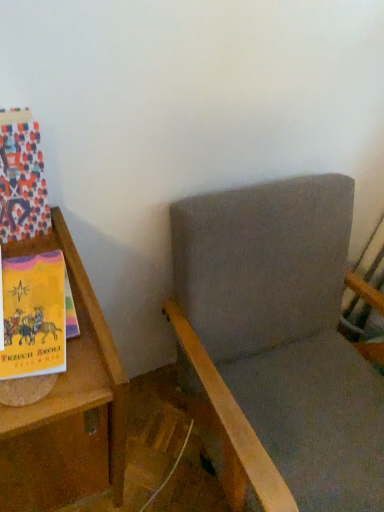
Question: Is wooden bookshelf at left at the left side of gray fabric rocking chair at center?

Choices:
 (A) yes
 (B) no

Answer: (A)

Question: Considering the relative sizes of wooden bookshelf at left and gray fabric rocking chair at center in the image provided, is wooden bookshelf at left shorter than gray fabric rocking chair at center?

Choices:
 (A) yes
 (B) no

Answer: (A)

Question: From the image's perspective, is wooden bookshelf at left on top of gray fabric rocking chair at center?

Choices:
 (A) yes
 (B) no

Answer: (B)

Question: Can you confirm if wooden bookshelf at left is thinner than gray fabric rocking chair at center?

Choices:
 (A) yes
 (B) no

Answer: (A)

Question: Does wooden bookshelf at left have a larger size compared to gray fabric rocking chair at center?

Choices:
 (A) no
 (B) yes

Answer: (A)

Question: Considering the positions of wooden bookshelf at left and multicolored paper at left in the image, is wooden bookshelf at left taller or shorter than multicolored paper at left?

Choices:
 (A) short
 (B) tall

Answer: (B)

Question: From a real-world perspective, is wooden bookshelf at left positioned above or below multicolored paper at left?

Choices:
 (A) below
 (B) above

Answer: (A)

Question: Is wooden bookshelf at left inside or outside of multicolored paper at left?

Choices:
 (A) outside
 (B) inside

Answer: (A)

Question: Is wooden bookshelf at left in front of or behind multicolored paper at left in the image?

Choices:
 (A) front
 (B) behind

Answer: (A)

Question: Would you say multicolored paper at left is to the left or to the right of gray fabric rocking chair at center in the picture?

Choices:
 (A) left
 (B) right

Answer: (A)

Question: Looking at their shapes, would you say multicolored paper at left is wider or thinner than gray fabric rocking chair at center?

Choices:
 (A) thin
 (B) wide

Answer: (A)

Question: Considering their positions, is multicolored paper at left located in front of or behind gray fabric rocking chair at center?

Choices:
 (A) front
 (B) behind

Answer: (B)

Question: From the image's perspective, is multicolored paper at left positioned above or below gray fabric rocking chair at center?

Choices:
 (A) below
 (B) above

Answer: (B)

Question: In the image, is gray fabric rocking chair at center positioned in front of or behind multicolored paper at left?

Choices:
 (A) behind
 (B) front

Answer: (B)

Question: From a real-world perspective, is gray fabric rocking chair at center physically located above or below multicolored paper at left?

Choices:
 (A) below
 (B) above

Answer: (A)